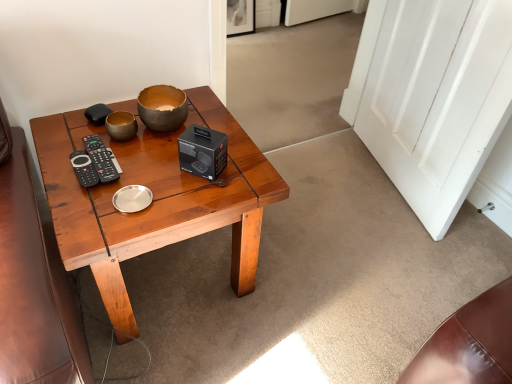
You are a GUI agent. You are given a task and a screenshot of the screen. Output one action in this format:
    pyautogui.click(x=<x>, y=<y>)
    Task: Click on the vacant area that lies between wooden coffee table at center and white glossy door at right
    
    Given the screenshot: What is the action you would take?
    pos(323,221)